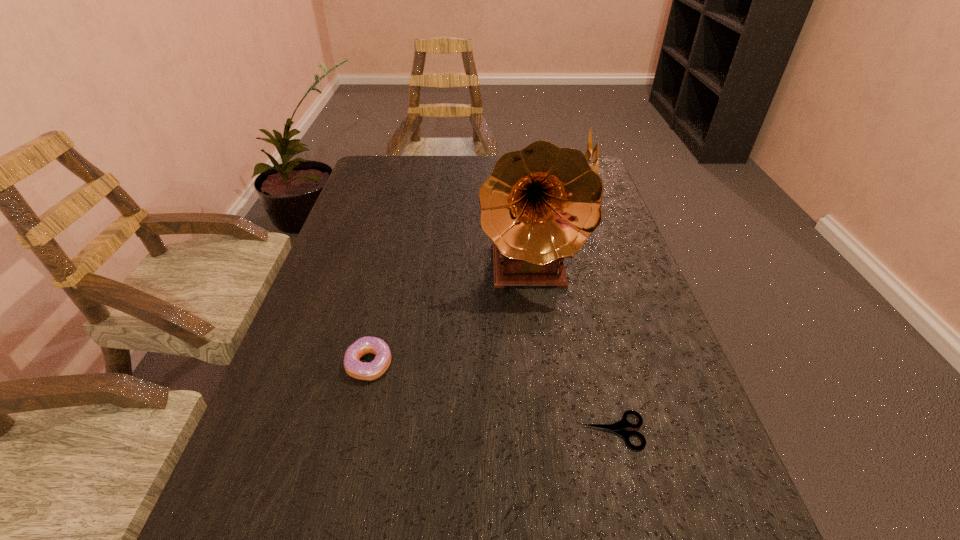
Identify the location of the tallest object. This screenshot has width=960, height=540. (540, 204).

You are a GUI agent. You are given a task and a screenshot of the screen. Output one action in this format:
    pyautogui.click(x=<x>, y=<y>)
    Task: Click on the phonograph_record
    The width and height of the screenshot is (960, 540).
    Given the screenshot: What is the action you would take?
    pyautogui.click(x=540, y=204)

The width and height of the screenshot is (960, 540). Find the location of `the rightmost object`. the rightmost object is located at coordinates (594, 153).

The width and height of the screenshot is (960, 540). I want to click on the third shortest object, so click(594, 153).

Find the location of a particular element. This screenshot has width=960, height=540. doughnut is located at coordinates (376, 368).

Locate an element on the screen. Image resolution: width=960 pixels, height=540 pixels. the third farthest object is located at coordinates click(x=376, y=368).

Where is `shears`? Image resolution: width=960 pixels, height=540 pixels. shears is located at coordinates (618, 427).

The width and height of the screenshot is (960, 540). What are the coordinates of `the nearest object` in the screenshot? It's located at (618, 427).

At what (x,y) coordinates should I click in order to perform the action: click on vacant space located 0.090m on the horn of the third nearest object. Please return your answer as a coordinate pair (x, y). Looking at the image, I should click on (538, 338).

Locate an element on the screen. The image size is (960, 540). vacant area situated 0.340m on the front-facing side of the farthest object is located at coordinates (469, 185).